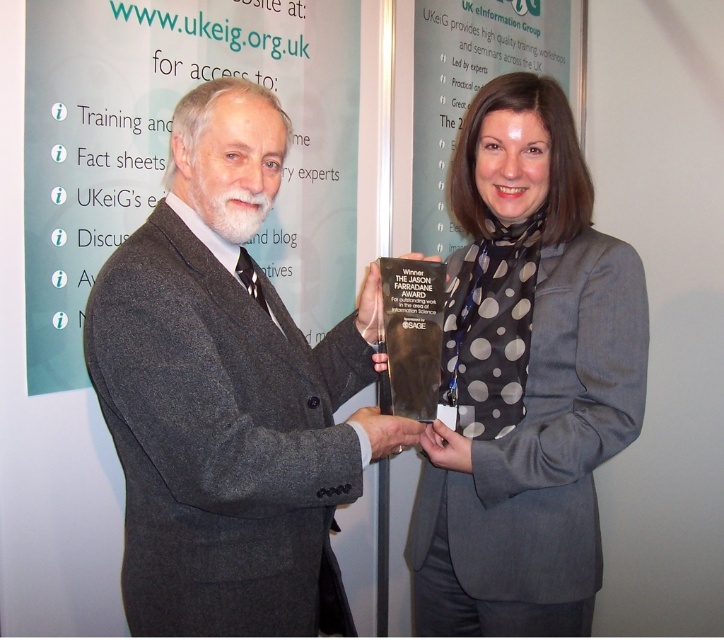
You are organizing a photo shoot and need to ensure that all items in the image are labeled correctly. Which item is larger in size between the dark gray suit at center and the polka dot scarf at center?

The dark gray suit at center is bigger than the polka dot scarf at center.

You are taking a photo of the award presentation scene. You notice two points marked in the image. Which point, point (x=371, y=435) or point (x=573, y=426), is closer to the camera?

Point (x=371, y=435) is closer to the camera than point (x=573, y=426).

Looking at this image, you are a photographer positioned in front of the two people. You want to take a photo of the dark gray suit at center and the polka dot scarf at center without any overlap between them. Given that your camera has a minimum focus distance of 30 centimeters, can you capture both items clearly in the same frame?

The distance between the dark gray suit at center and the polka dot scarf at center is 33.80 centimeters, which is greater than the camera minimum focus distance of 30 centimeters. Therefore, you can capture both items clearly in the same frame without overlap.